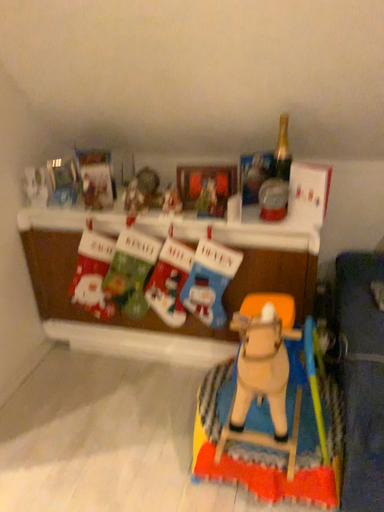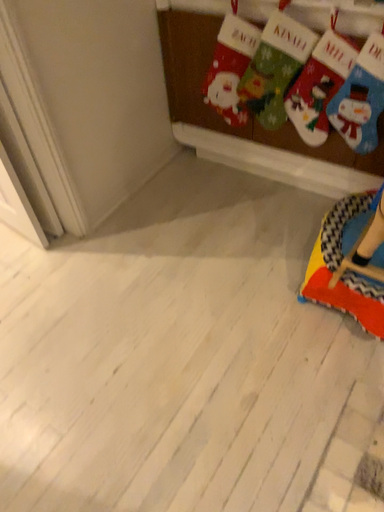
Question: How did the camera likely rotate when shooting the video?

Choices:
 (A) rotated left
 (B) rotated right

Answer: (A)